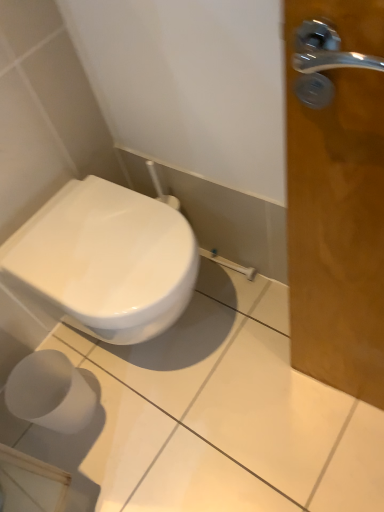
I want to click on free space in front of white glossy toilet at lower left, so [190, 440].